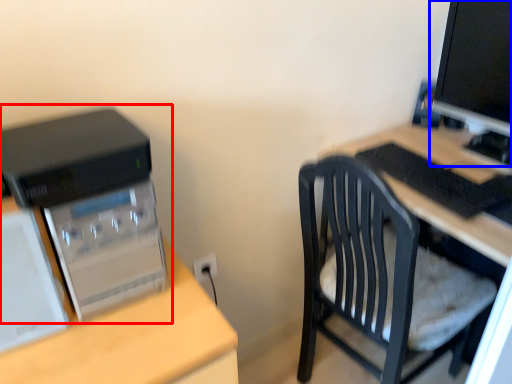
Question: Which object appears closest to the camera in this image, computer tower (highlighted by a red box) or computer monitor (highlighted by a blue box)?

Choices:
 (A) computer tower
 (B) computer monitor

Answer: (A)